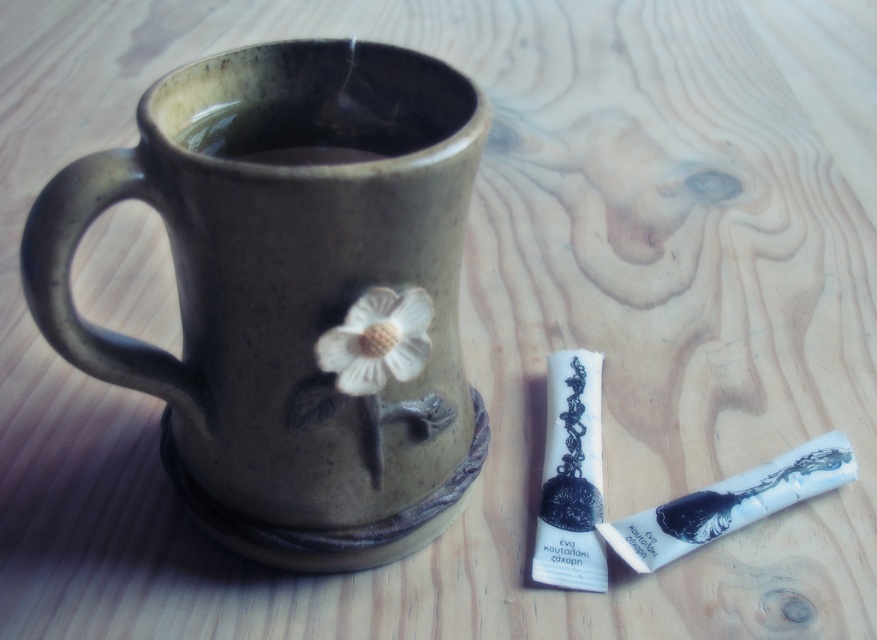
You are holding a camera and want to take a photo of both the matte ceramic mug at center and the white matte flower at center. Which object will appear larger in the photo?

The matte ceramic mug at center will appear larger in the photo because it is closer to the viewer than the white matte flower at center.

You are a delivery person who needs to place a package that is 36 inches long on the table. The package must be placed between the brown matte tea at upper center and the edge of the table. Is there enough space?

The brown matte tea at upper center and the viewer are 36.51 inches apart. Since the package is 36 inches long, there is enough space to place it between the brown matte tea at upper center and the edge of the table as the distance is slightly larger than the package length.